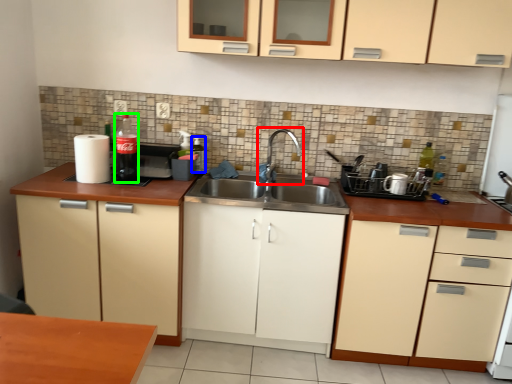
Question: Which object is positioned farthest from tap (highlighted by a red box)? Select from bottle (highlighted by a blue box) and bottle (highlighted by a green box).

Choices:
 (A) bottle
 (B) bottle

Answer: (B)